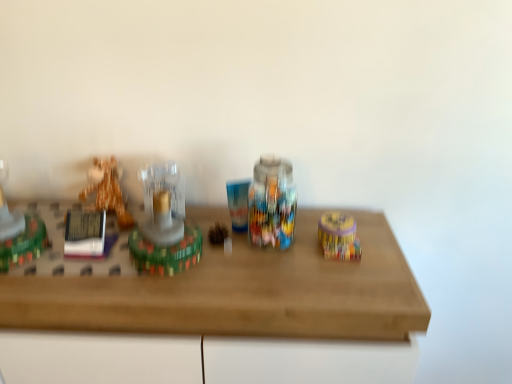
Identify the location of free space in front of translucent glass candle at center, placed as the third toy when sorted from left to right. (157, 294).